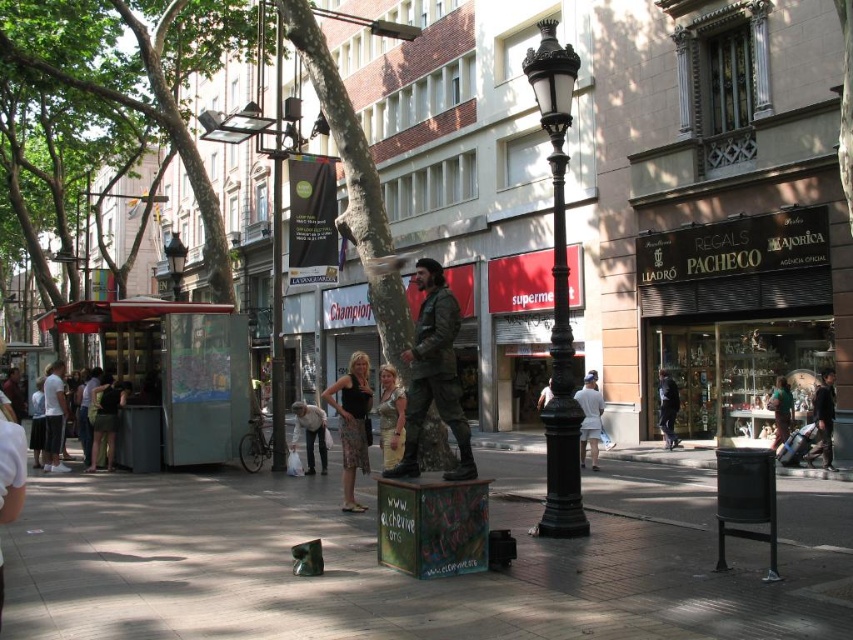
You are a photographer trying to capture both the dark green fabric jacket at lower left and the denim pants at center in a single frame. Based on their sizes, which object should you focus on to ensure both fit in the photo?

The dark green fabric jacket at lower left occupies less space than the denim pants at center, so you should focus on the denim pants at center to ensure both fit in the photo.